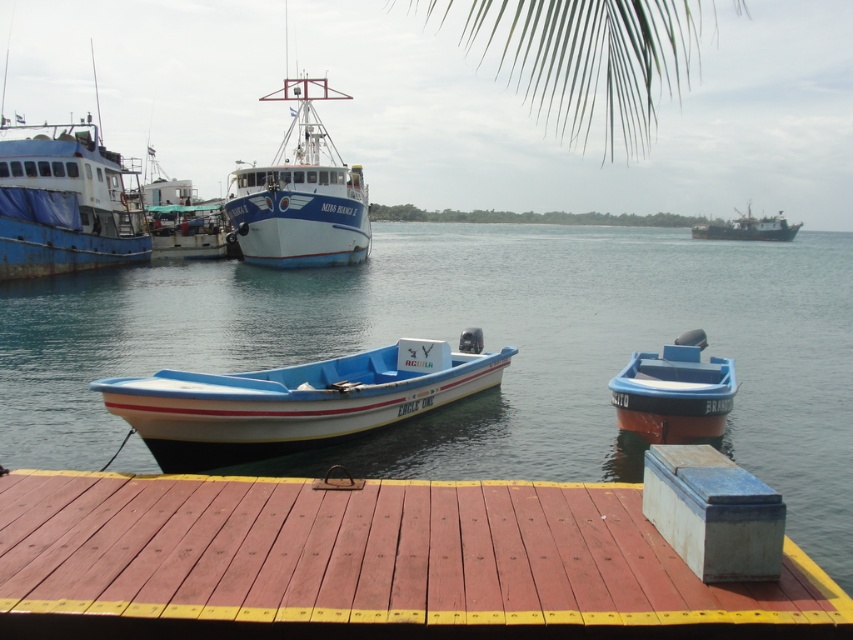
Question: Which is nearer to the blue plastic boat at right?

Choices:
 (A) white glossy boat at center
 (B) clear water at center
 (C) white matte ship at upper right

Answer: (B)

Question: Considering the relative positions of white plastic boat at center and white matte ship at upper right in the image provided, where is white plastic boat at center located with respect to white matte ship at upper right?

Choices:
 (A) right
 (B) left

Answer: (B)

Question: Among these points, which one is farthest from the camera?

Choices:
 (A) (518, 88)
 (B) (515, 332)
 (C) (380, 392)

Answer: (A)

Question: Which point is closer to the camera?

Choices:
 (A) clear water at center
 (B) white matte ship at upper right

Answer: (A)

Question: Is the position of clear water at center more distant than that of green leafy palm at upper center?

Choices:
 (A) no
 (B) yes

Answer: (B)

Question: Is blue painted metal boat at left below white glossy boat at center?

Choices:
 (A) yes
 (B) no

Answer: (A)